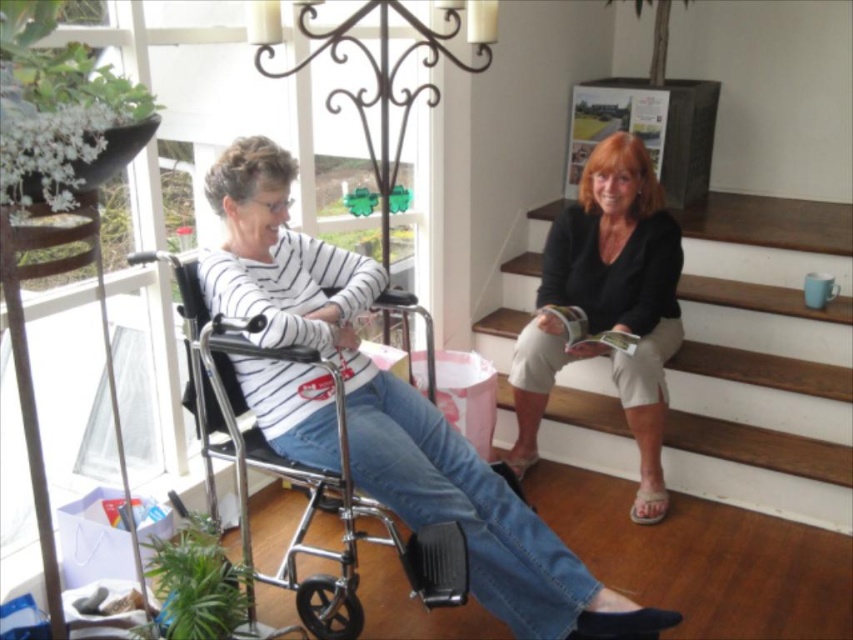
Between point (279, 579) and point (636, 493), which one is positioned in front?

Point (279, 579) is more forward.

Does silver metallic wheelchair at left have a larger size compared to white fabric sandal at lower right?

Yes.

Is point (309, 589) less distant than point (657, 513)?

Yes, it is.

Identify the location of silver metallic wheelchair at left. This screenshot has width=853, height=640. (300, 474).

Does white fabric sandal at lower right have a greater height compared to beige fabric sandal at lower right?

Yes, white fabric sandal at lower right is taller than beige fabric sandal at lower right.

Is point (641, 508) farther from viewer compared to point (527, 458)?

No, (641, 508) is closer to viewer.

Where is `white fabric sandal at lower right`? This screenshot has width=853, height=640. white fabric sandal at lower right is located at coordinates (648, 506).

The width and height of the screenshot is (853, 640). Identify the location of white fabric sandal at lower right. (648, 506).

Image resolution: width=853 pixels, height=640 pixels. What do you see at coordinates (763, 360) in the screenshot? I see `wooden stair at upper right` at bounding box center [763, 360].

This screenshot has width=853, height=640. Identify the location of wooden stair at upper right. coord(763,360).

Where is `wooden stair at upper right`? wooden stair at upper right is located at coordinates (763, 360).